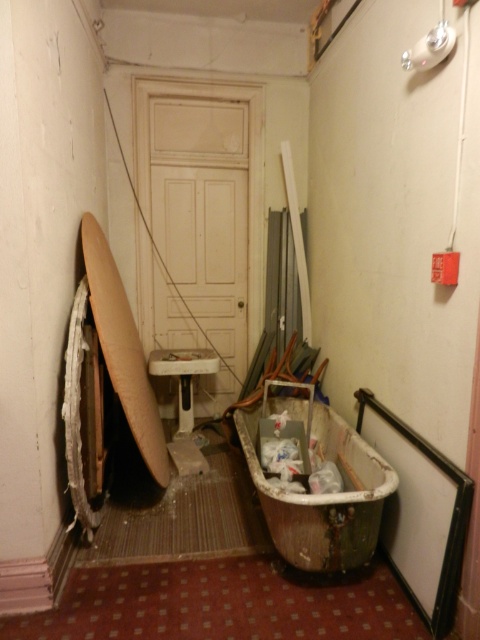
You are a delivery person carrying a package that requires a clear path to the white matte door at center. The light brown wooden surfboard at left is blocking the way. Can you move the surfboard to the side to access the door?

The white matte door at center is further to the viewer than the light brown wooden surfboard at left, so the surfboard is closer to you. You can move the light brown wooden surfboard at left out of the way to access the door.

Looking at this image, you are standing in the hallway and need to move from point A to point B. If point A is at coordinates point (132,136) and point B is at coordinates point (112,300), which direction should you move to reach point B from point A?

To move from point (132,136) to point (112,300), you should move towards the northeast direction since point B is northeast of point A.